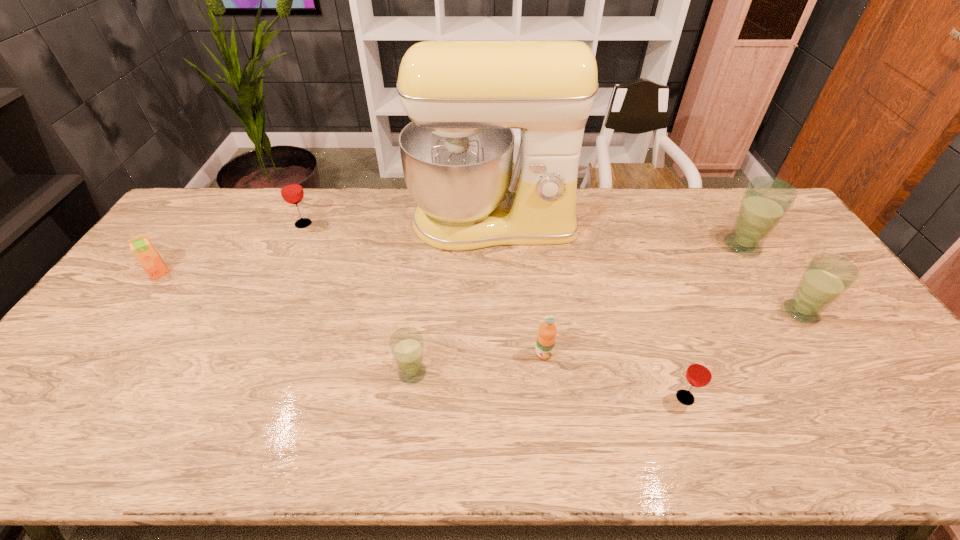
This screenshot has width=960, height=540. In order to click on the tallest object in this screenshot , I will do `click(464, 97)`.

Identify the location of the second tallest object. The width and height of the screenshot is (960, 540). (766, 200).

I want to click on the second farthest glass, so click(766, 200).

Where is `the bigger red glass`? Image resolution: width=960 pixels, height=540 pixels. the bigger red glass is located at coordinates (x=291, y=190).

I want to click on the farther red glass, so click(291, 190).

Identify the location of the second farthest blue glass. This screenshot has height=540, width=960. (827, 276).

I want to click on the third farthest glass, so click(x=827, y=276).

Locate an element on the screen. This screenshot has width=960, height=540. the farther orange juice is located at coordinates (142, 248).

Identify the location of the leftmost object. (142, 248).

This screenshot has width=960, height=540. I want to click on the right orange juice, so click(x=546, y=337).